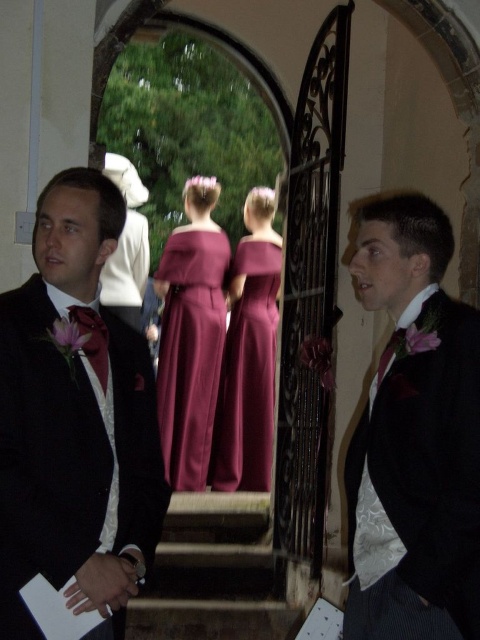
Between matte black suit at left and burgundy satin dresses at center, which one has less height?

Standing shorter between the two is matte black suit at left.

Who is higher up, matte black suit at left or burgundy satin dresses at center?

burgundy satin dresses at center is above.

Describe the element at coordinates (74, 420) in the screenshot. I see `matte black suit at left` at that location.

You are a GUI agent. You are given a task and a screenshot of the screen. Output one action in this format:
    pyautogui.click(x=<x>, y=<y>)
    Task: Click on the matte black suit at left
    The width and height of the screenshot is (480, 640).
    Given the screenshot: What is the action you would take?
    pyautogui.click(x=74, y=420)

Measure the distance between point (148, 616) and camera.

Point (148, 616) and camera are 6.59 meters apart from each other.

Can you confirm if wooden staircase at center is smaller than burgundy satin dress at center?

Actually, wooden staircase at center might be larger than burgundy satin dress at center.

Identify the location of wooden staircase at center. The image size is (480, 640). (213, 573).

Measure the distance from matte burgundy dress at center to burgundy satin dress at center.

A distance of 18.31 inches exists between matte burgundy dress at center and burgundy satin dress at center.

Who is more forward, (202, 285) or (252, 364)?

Positioned in front is point (252, 364).

Describe the element at coordinates (191, 349) in the screenshot. The width and height of the screenshot is (480, 640). I see `matte burgundy dress at center` at that location.

Find the location of a particular element. The image size is (480, 640). matte burgundy dress at center is located at coordinates (191, 349).